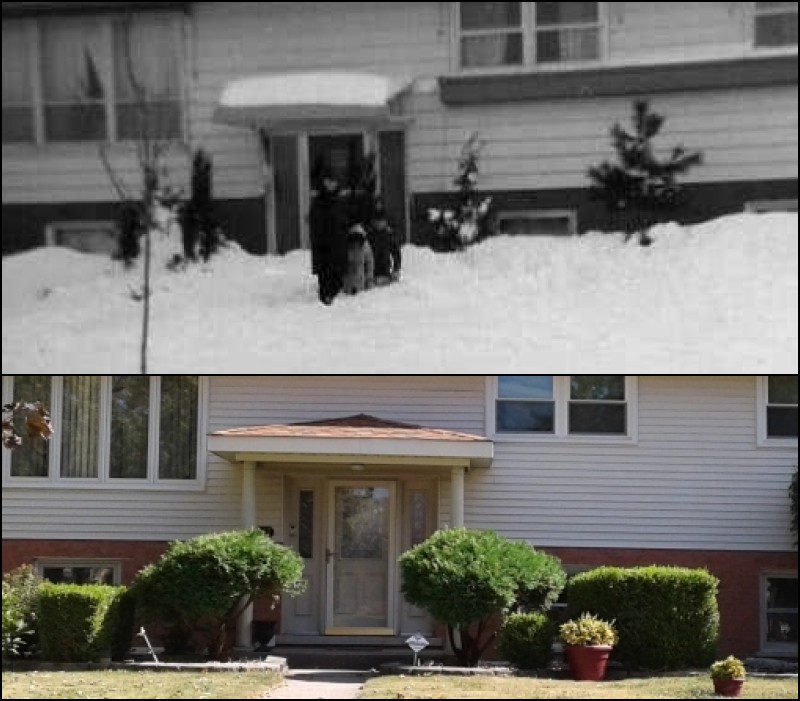
You are a GUI agent. You are given a task and a screenshot of the screen. Output one action in this format:
    pyautogui.click(x=<x>, y=<y>)
    Task: Click on the front door
    The image size is (800, 701).
    Given the screenshot: What is the action you would take?
    pyautogui.click(x=322, y=148), pyautogui.click(x=350, y=564)